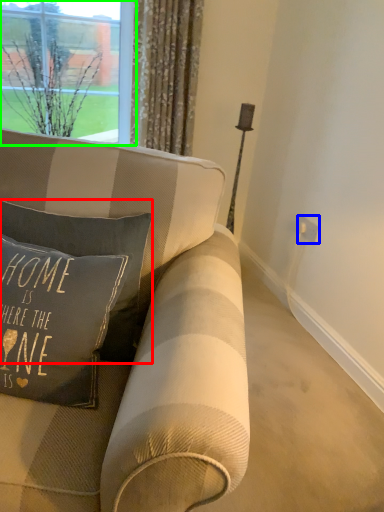
Question: Estimate the real-world distances between objects in this image. Which object is farther from pillow (highlighted by a red box), electric outlet (highlighted by a blue box) or window (highlighted by a green box)?

Choices:
 (A) electric outlet
 (B) window

Answer: (A)